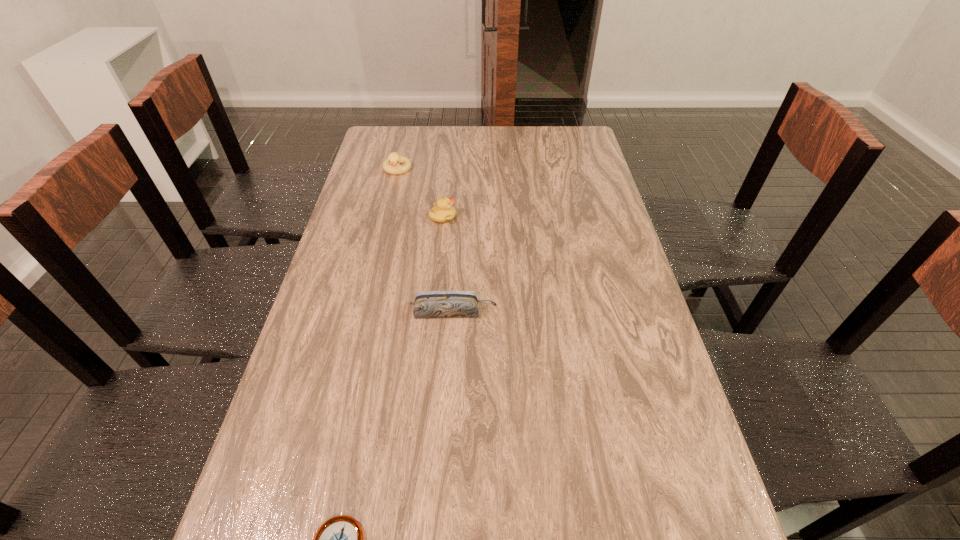
In the image, there is a desktop. In order to click on vacant space at the left edge in this screenshot , I will do `click(365, 184)`.

You are a GUI agent. You are given a task and a screenshot of the screen. Output one action in this format:
    pyautogui.click(x=<x>, y=<y>)
    Task: Click on the vacant space at the right edge of the desktop
    The height and width of the screenshot is (540, 960).
    Given the screenshot: What is the action you would take?
    pyautogui.click(x=567, y=164)

In the image, there is a desktop. At what (x,y) coordinates should I click in order to perform the action: click on free space at the far left corner. Please return your answer as a coordinate pair (x, y). Image resolution: width=960 pixels, height=540 pixels. Looking at the image, I should click on (382, 137).

Identify the location of vacant space at the far right corner. The width and height of the screenshot is (960, 540). (568, 138).

Locate an element on the screen. vacant region between the third farthest object and the farther duckling is located at coordinates (425, 241).

At what (x,y) coordinates should I click in order to perform the action: click on free space that is in between the right duckling and the pencil box. Please return your answer as a coordinate pair (x, y). The image size is (960, 540). Looking at the image, I should click on (448, 264).

The width and height of the screenshot is (960, 540). I want to click on vacant point located between the nearer duckling and the pencil box, so click(x=448, y=264).

Where is `free point between the third farthest object and the farthest object`? The height and width of the screenshot is (540, 960). free point between the third farthest object and the farthest object is located at coordinates tap(425, 241).

What are the coordinates of `free space between the left duckling and the third farthest object` in the screenshot? It's located at (425, 241).

Identify the location of free space between the pencil box and the second farthest object. (448, 264).